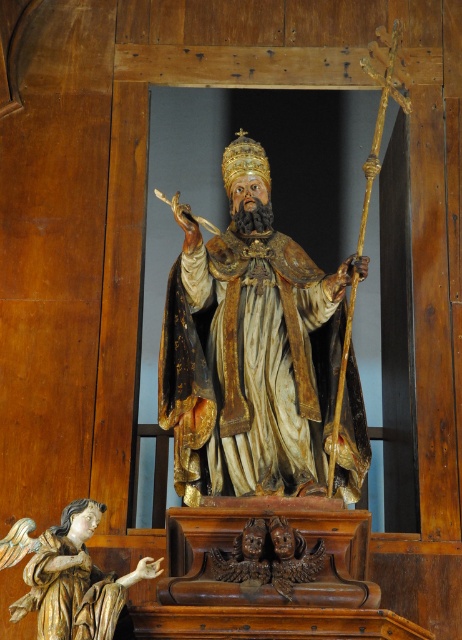
Question: Which of the following is the closest to the observer?

Choices:
 (A) (196, 268)
 (B) (48, 552)

Answer: (B)

Question: Which object is farther from the camera taking this photo?

Choices:
 (A) wooden angel at lower left
 (B) wooden statue at center

Answer: (B)

Question: Can you confirm if wooden statue at center is smaller than wooden angel at lower left?

Choices:
 (A) yes
 (B) no

Answer: (B)

Question: Does wooden statue at center lie in front of wooden angel at lower left?

Choices:
 (A) yes
 (B) no

Answer: (B)

Question: Is wooden statue at center above wooden angel at lower left?

Choices:
 (A) yes
 (B) no

Answer: (A)